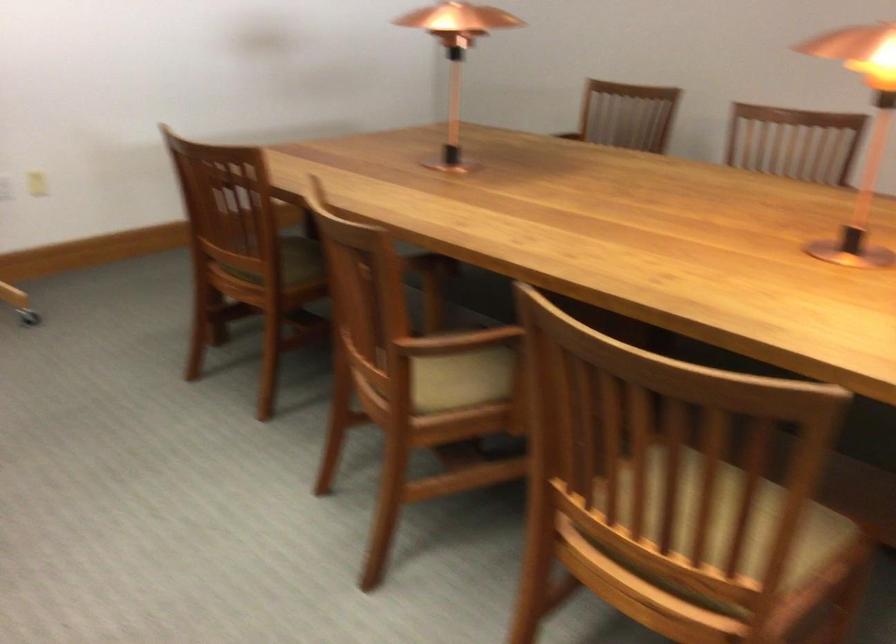
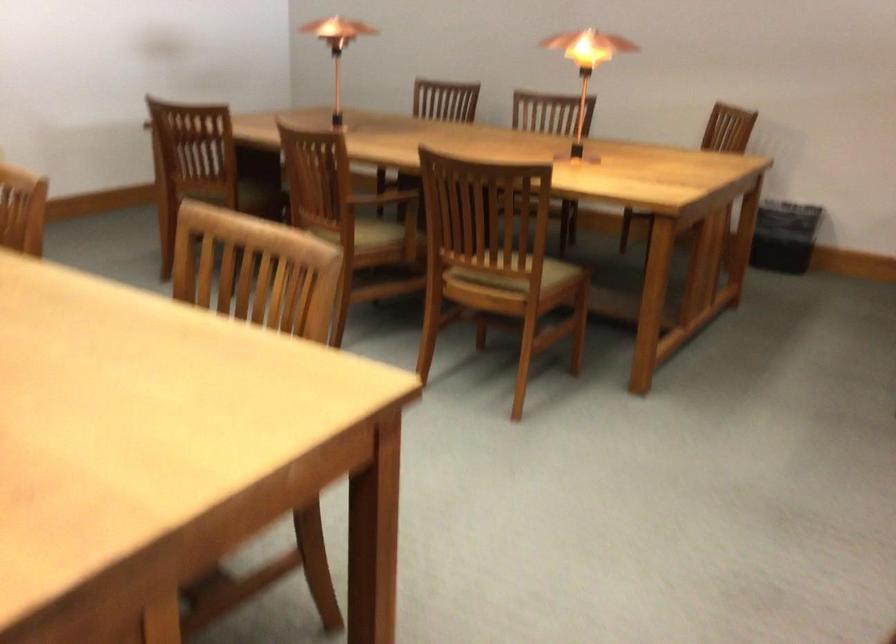
What movement of the cameraman would produce the second image?

The cameraman walked toward left, backward.